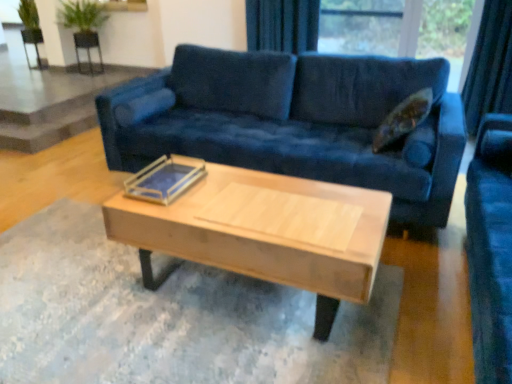
Question: From the image's perspective, is metallic silver armchair at upper left, marked as the first armchair in a left-to-right arrangement, located above velvet blue couch at center?

Choices:
 (A) no
 (B) yes

Answer: (B)

Question: Can you confirm if metallic silver armchair at upper left, the second armchair in the right-to-left sequence, is smaller than velvet blue couch at center?

Choices:
 (A) yes
 (B) no

Answer: (A)

Question: Is metallic silver armchair at upper left, marked as the first armchair in a left-to-right arrangement, far away from velvet blue couch at center?

Choices:
 (A) no
 (B) yes

Answer: (B)

Question: Is metallic silver armchair at upper left, marked as the first armchair in a left-to-right arrangement, not within velvet blue couch at center?

Choices:
 (A) yes
 (B) no

Answer: (A)

Question: Does metallic silver armchair at upper left, marked as the first armchair in a left-to-right arrangement, turn towards velvet blue couch at center?

Choices:
 (A) no
 (B) yes

Answer: (A)

Question: From the image's perspective, is metallic silver armchair at upper left, marked as the first armchair in a left-to-right arrangement, below velvet blue couch at center?

Choices:
 (A) no
 (B) yes

Answer: (A)

Question: Is metallic silver armchair at upper left, the second armchair in the right-to-left sequence, oriented away from velvet dark blue curtain at upper center?

Choices:
 (A) no
 (B) yes

Answer: (A)

Question: Does metallic silver armchair at upper left, the second armchair in the right-to-left sequence, come behind velvet dark blue curtain at upper center?

Choices:
 (A) yes
 (B) no

Answer: (A)

Question: Is metallic silver armchair at upper left, the second armchair in the right-to-left sequence, to the right of velvet dark blue curtain at upper center from the viewer's perspective?

Choices:
 (A) no
 (B) yes

Answer: (A)

Question: Are metallic silver armchair at upper left, the second armchair in the right-to-left sequence, and velvet dark blue curtain at upper center far apart?

Choices:
 (A) yes
 (B) no

Answer: (A)

Question: From the image's perspective, is metallic silver armchair at upper left, marked as the first armchair in a left-to-right arrangement, located beneath velvet dark blue curtain at upper center?

Choices:
 (A) no
 (B) yes

Answer: (A)

Question: Considering the relative sizes of metallic silver armchair at upper left, marked as the first armchair in a left-to-right arrangement, and velvet dark blue curtain at upper center in the image provided, is metallic silver armchair at upper left, marked as the first armchair in a left-to-right arrangement, bigger than velvet dark blue curtain at upper center?

Choices:
 (A) yes
 (B) no

Answer: (B)

Question: Is light wood/wooden coffee table at center positioned far away from black mesh chair at upper left, positioned as the first armchair in right-to-left order?

Choices:
 (A) no
 (B) yes

Answer: (B)